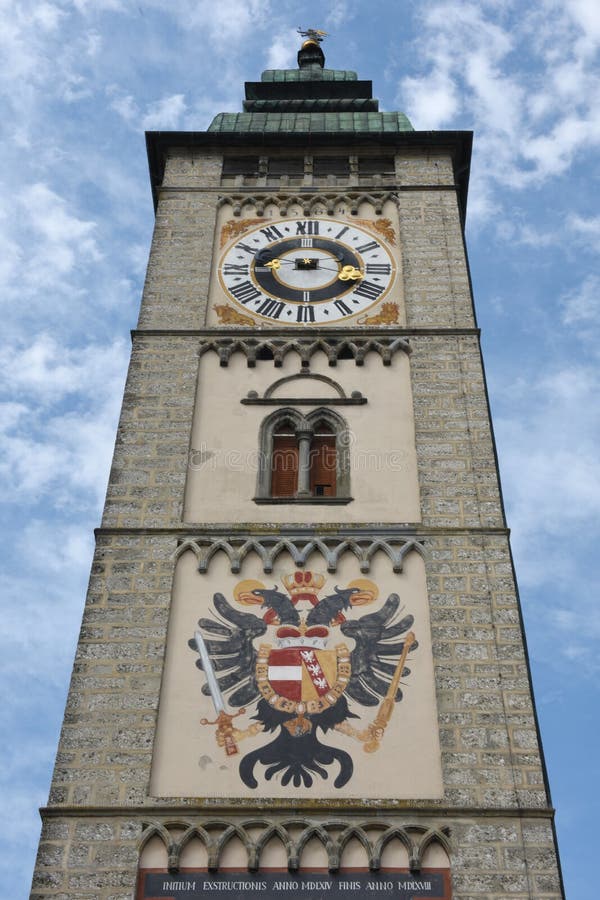
Where is `clock`? clock is located at coordinates (302, 263).